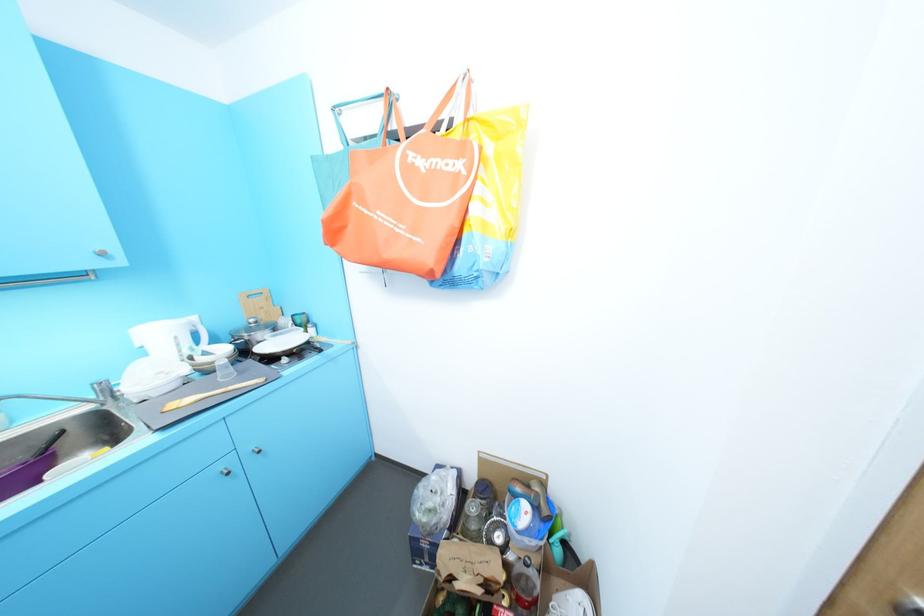
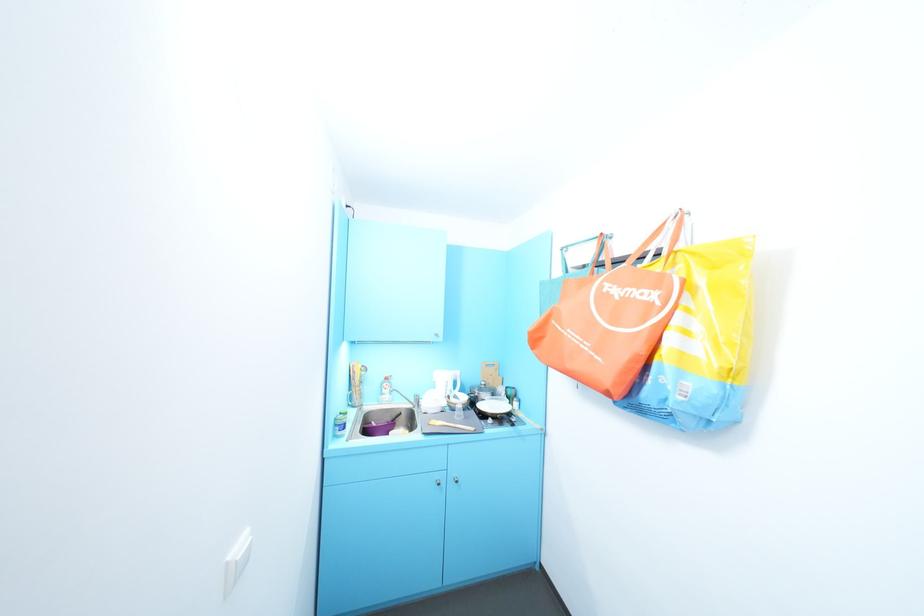
Where in the second image is the point corresponding to point 28,459 from the first image?

(395, 419)